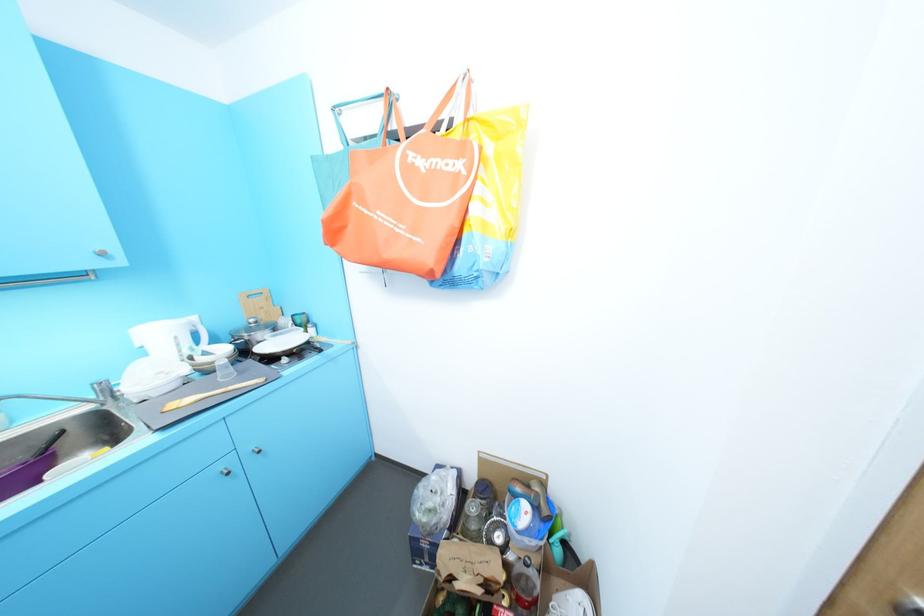
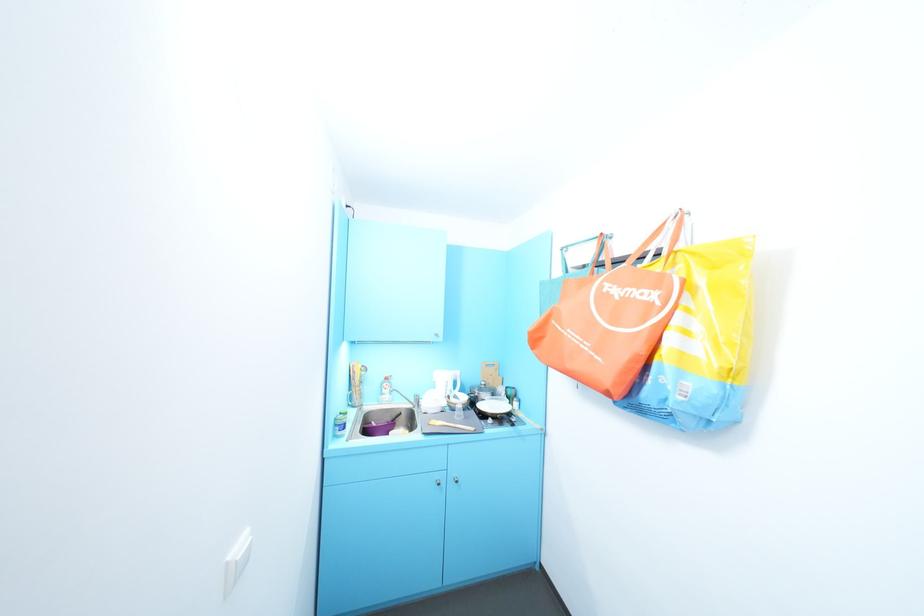
Where in the second image is the point corresponding to point 28,459 from the first image?

(395, 419)